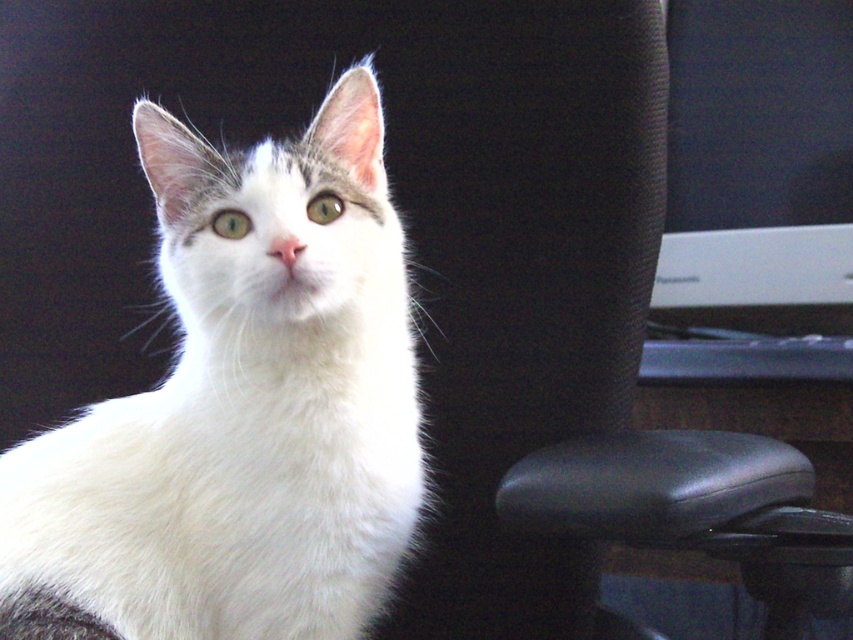
Question: Which of the following is the farthest from the observer?

Choices:
 (A) (788, 227)
 (B) (102, 520)

Answer: (A)

Question: Which point appears farthest from the camera in this image?

Choices:
 (A) (346, 604)
 (B) (772, 330)

Answer: (B)

Question: Does white fur cat at center have a greater width compared to white plastic monitor at right?

Choices:
 (A) yes
 (B) no

Answer: (A)

Question: Is white fur cat at center wider than white plastic monitor at right?

Choices:
 (A) yes
 (B) no

Answer: (A)

Question: Among these points, which one is nearest to the camera?

Choices:
 (A) (711, 164)
 (B) (204, 304)

Answer: (B)

Question: Is white fur cat at center smaller than white plastic monitor at right?

Choices:
 (A) yes
 (B) no

Answer: (A)